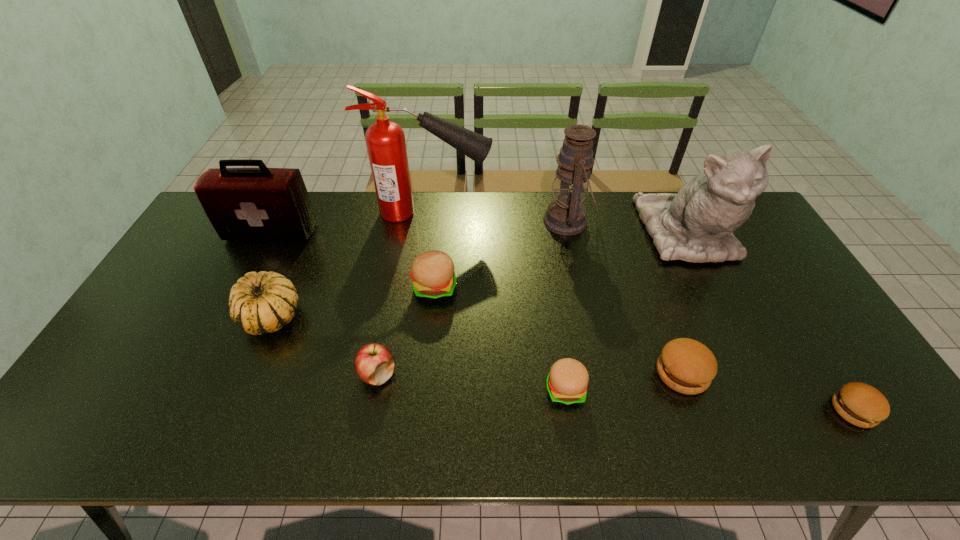
At what (x,y) coordinates should I click in order to perform the action: click on free space located on the right of the fifth tallest object. Please return your answer as a coordinate pair (x, y). Looking at the image, I should click on (424, 316).

You are a GUI agent. You are given a task and a screenshot of the screen. Output one action in this format:
    pyautogui.click(x=<x>, y=<y>)
    Task: Click on the blank space located 0.160m on the front of the bigger beige hamburger
    This screenshot has width=960, height=540.
    Given the screenshot: What is the action you would take?
    pyautogui.click(x=428, y=351)

The width and height of the screenshot is (960, 540). Find the location of `free space located on the right of the apple`. free space located on the right of the apple is located at coordinates (476, 374).

Where is `free region located 0.330m on the right of the bigger brown hamburger`? This screenshot has width=960, height=540. free region located 0.330m on the right of the bigger brown hamburger is located at coordinates (840, 373).

Image resolution: width=960 pixels, height=540 pixels. I want to click on free spot located on the back of the third hamburger from right to left, so click(x=549, y=282).

Locate an element on the screen. This screenshot has height=540, width=960. free space located 0.150m on the left of the shortest hamburger is located at coordinates (769, 410).

Where is `fire extinguisher that is positioned at the far edge`? fire extinguisher that is positioned at the far edge is located at coordinates (385, 140).

The width and height of the screenshot is (960, 540). In order to click on cat at the far edge in this screenshot , I will do 696,224.

This screenshot has width=960, height=540. I want to click on oil lamp present at the far edge, so click(566, 215).

Image resolution: width=960 pixels, height=540 pixels. I want to click on the first aid kit present at the far edge, so click(243, 204).